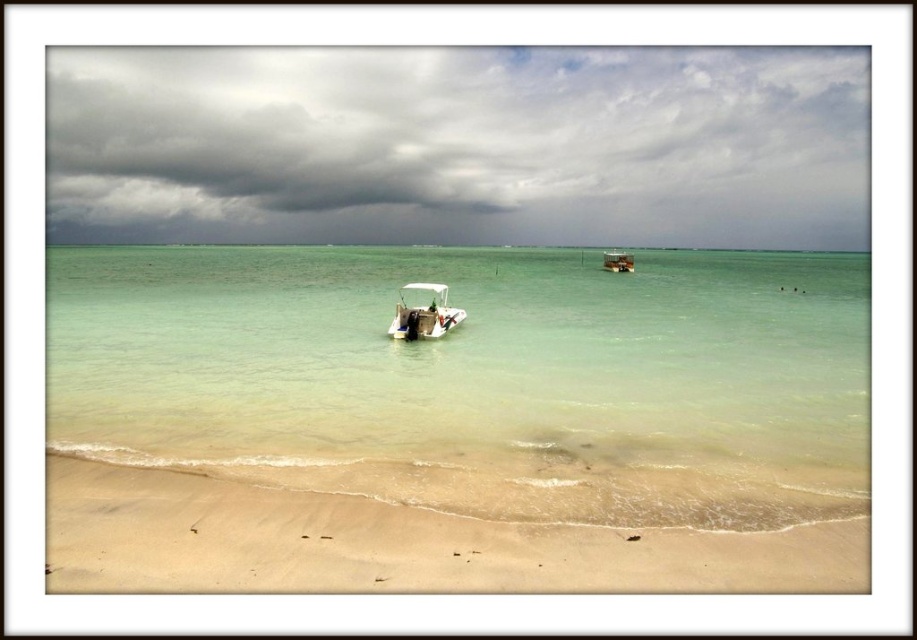
What do you see at coordinates (477, 378) in the screenshot? This screenshot has width=917, height=640. I see `clear water at center` at bounding box center [477, 378].

Is clear water at center to the right of beige sandy beach at lower center from the viewer's perspective?

Correct, you'll find clear water at center to the right of beige sandy beach at lower center.

This screenshot has width=917, height=640. What do you see at coordinates (477, 378) in the screenshot?
I see `clear water at center` at bounding box center [477, 378].

At what (x,y) coordinates should I click in order to perform the action: click on clear water at center. Please return your answer as a coordinate pair (x, y). Looking at the image, I should click on (477, 378).

Can you confirm if white matte boat at center is positioned above wooden cabin boat at upper center?

Actually, white matte boat at center is below wooden cabin boat at upper center.

Does white matte boat at center come behind wooden cabin boat at upper center?

No.

The height and width of the screenshot is (640, 917). Identify the location of white matte boat at center. (424, 314).

Is point (246, 74) positioned before point (427, 282)?

No, it is not.

Which is behind, point (763, 196) or point (407, 314)?

Positioned behind is point (763, 196).

Does point (162, 230) lie behind point (404, 328)?

Yes, it is.

The image size is (917, 640). Identify the location of cloudy sky at upper center. (460, 147).